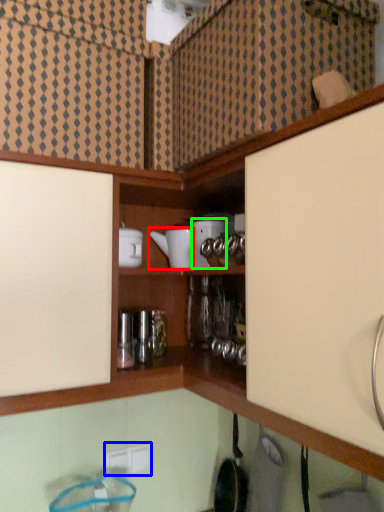
Question: Which object is positioned closest to appliance (highlighted by a red box)? Select from electric outlet (highlighted by a blue box) and appliance (highlighted by a green box).

Choices:
 (A) electric outlet
 (B) appliance

Answer: (B)